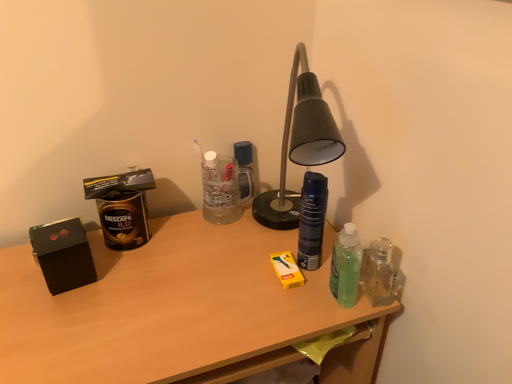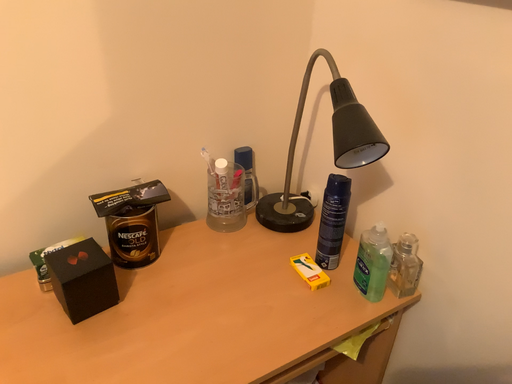
Question: Which way did the camera rotate in the video?

Choices:
 (A) rotated right
 (B) rotated left

Answer: (A)